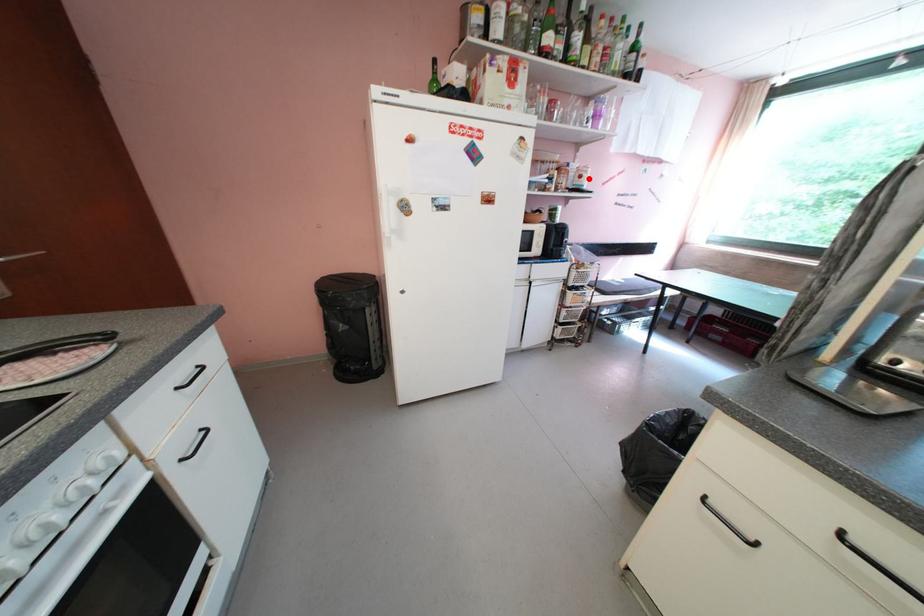
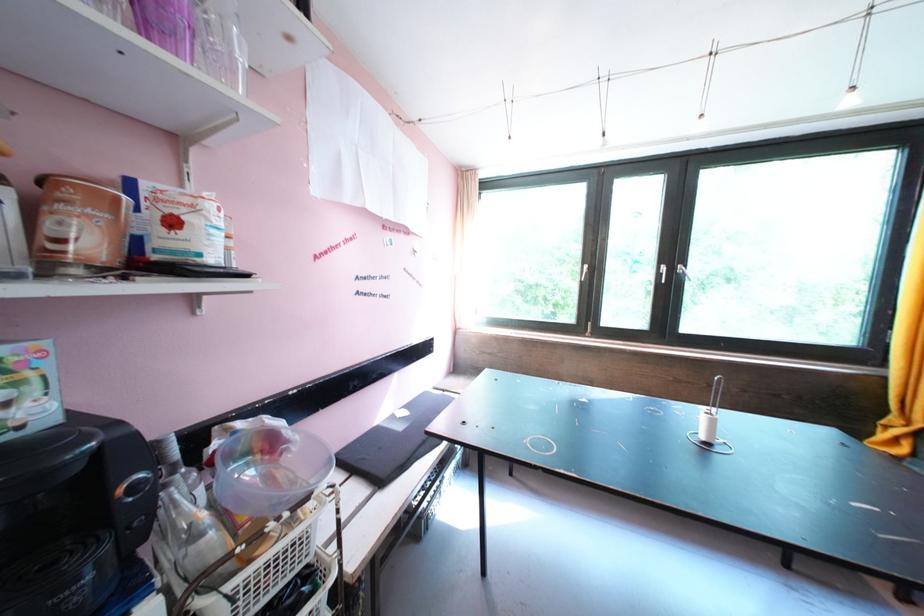
Question: I am providing you with two images of the same scene from different viewpoints. Image1 has a red point marked. In image2, the corresponding 3D location appears at what relative position? Reply with the corresponding letter.

Choices:
 (A) Closer
 (B) Farther

Answer: (B)